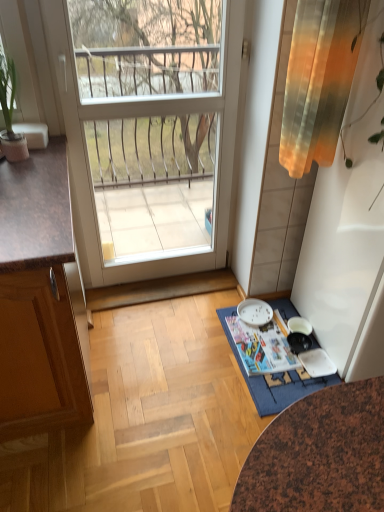
This screenshot has height=512, width=384. Describe the element at coordinates (88, 168) in the screenshot. I see `white glossy door at center` at that location.

Where is `white glossy door at center`? white glossy door at center is located at coordinates (88, 168).

Where is `blue fabric doormat at lower center`? The height and width of the screenshot is (512, 384). blue fabric doormat at lower center is located at coordinates (266, 384).

What do you see at coordinates (254, 312) in the screenshot? The height and width of the screenshot is (512, 384). I see `white glossy plate at lower center` at bounding box center [254, 312].

Find the location of `white glossy plate at lower center`. white glossy plate at lower center is located at coordinates (254, 312).

In order to click on gradient fabric curtain at upper right in this screenshot , I will do [319, 80].

Consider the image. Considering the sizes of gradient fabric curtain at upper right and white glossy plate at lower center in the image, is gradient fabric curtain at upper right bigger or smaller than white glossy plate at lower center?

Considering their sizes, gradient fabric curtain at upper right takes up more space than white glossy plate at lower center.

Are gradient fabric curtain at upper right and white glossy plate at lower center far apart?

Yes, gradient fabric curtain at upper right is far from white glossy plate at lower center.

Consider the image. From the image's perspective, which object appears higher, gradient fabric curtain at upper right or white glossy plate at lower center?

gradient fabric curtain at upper right is shown above in the image.

Which of these two, white glossy door at center or green leafy plant in pot at left, is wider?

Wider between the two is green leafy plant in pot at left.

Considering the sizes of objects white glossy door at center and green leafy plant in pot at left in the image provided, who is taller, white glossy door at center or green leafy plant in pot at left?

white glossy door at center.

Is point (65, 28) closer or farther from the camera than point (11, 94)?

Point (65, 28) is positioned closer to the camera compared to point (11, 94).

Is white glossy door at center inside the boundaries of green leafy plant in pot at left, or outside?

white glossy door at center is not inside green leafy plant in pot at left, it's outside.

Who is taller, white glossy plate at lower center or green leafy plant in pot at left?

Standing taller between the two is green leafy plant in pot at left.

Are white glossy plate at lower center and green leafy plant in pot at left making contact?

white glossy plate at lower center and green leafy plant in pot at left are clearly separated.

From a real-world perspective, is white glossy plate at lower center physically below green leafy plant in pot at left?

Yes, from a real-world perspective, white glossy plate at lower center is below green leafy plant in pot at left.

Which point is more distant from viewer, (312, 385) or (317, 114)?

Positioned behind is point (312, 385).

What's the angular difference between blue fabric doormat at lower center and gradient fabric curtain at upper right's facing directions?

The facing directions of blue fabric doormat at lower center and gradient fabric curtain at upper right are 0.434 degrees apart.

Based on the photo, considering the sizes of objects blue fabric doormat at lower center and gradient fabric curtain at upper right in the image provided, who is bigger, blue fabric doormat at lower center or gradient fabric curtain at upper right?

gradient fabric curtain at upper right.

Would you say blue fabric doormat at lower center is inside or outside gradient fabric curtain at upper right?

blue fabric doormat at lower center is located beyond the bounds of gradient fabric curtain at upper right.

Can you tell me how much white glossy plate at lower center and blue fabric doormat at lower center differ in facing direction?

There is a 0.434-degree angle between the facing directions of white glossy plate at lower center and blue fabric doormat at lower center.

Find the location of `doormat that is below the white glossy plate at lower center (from the image's perspective)`. doormat that is below the white glossy plate at lower center (from the image's perspective) is located at coordinates (266, 384).

Is white glossy plate at lower center outside of blue fabric doormat at lower center?

Indeed, white glossy plate at lower center is completely outside blue fabric doormat at lower center.

Considering the positions of objects white glossy plate at lower center and blue fabric doormat at lower center in the image provided, who is more to the left, white glossy plate at lower center or blue fabric doormat at lower center?

white glossy plate at lower center.

In terms of height, does blue fabric doormat at lower center look taller or shorter compared to white glossy plate at lower center?

In the image, blue fabric doormat at lower center appears to be shorter than white glossy plate at lower center.

Considering the positions of objects blue fabric doormat at lower center and white glossy plate at lower center in the image provided, who is more to the left, blue fabric doormat at lower center or white glossy plate at lower center?

white glossy plate at lower center.

Is blue fabric doormat at lower center closer to the viewer compared to white glossy plate at lower center?

Yes, the depth of blue fabric doormat at lower center is less than that of white glossy plate at lower center.

Is blue fabric doormat at lower center aimed at white glossy plate at lower center?

No, blue fabric doormat at lower center is not aimed at white glossy plate at lower center.

From the image's perspective, is white glossy door at center located above or below gradient fabric curtain at upper right?

From the image's perspective, white glossy door at center appears below gradient fabric curtain at upper right.

Measure the distance between white glossy door at center and gradient fabric curtain at upper right.

22.10 inches.

Does white glossy door at center lie behind gradient fabric curtain at upper right?

Yes, it is behind gradient fabric curtain at upper right.

Considering the points (69, 44) and (344, 5), which point is in front, point (69, 44) or point (344, 5)?

The point (344, 5) is closer to the camera.

The width and height of the screenshot is (384, 512). I want to click on curtain located in front of the white glossy plate at lower center, so click(319, 80).

What are the coordinates of `houseplant above the white glossy door at center (from the image's perspective)` in the screenshot? It's located at (10, 112).

From the image, which object appears to be nearer to gradient fabric curtain at upper right, blue fabric doormat at lower center or green leafy plant in pot at left?

green leafy plant in pot at left is positioned closer to the anchor gradient fabric curtain at upper right.

When comparing their distances from green leafy plant in pot at left, does gradient fabric curtain at upper right or white glossy plate at lower center seem closer?

Based on the image, gradient fabric curtain at upper right appears to be nearer to green leafy plant in pot at left.

Estimate the real-world distances between objects in this image. Which object is further from blue fabric doormat at lower center, gradient fabric curtain at upper right or white glossy door at center?

The object further to blue fabric doormat at lower center is gradient fabric curtain at upper right.

Considering their positions, is white glossy plate at lower center positioned further to blue fabric doormat at lower center than white glossy door at center?

white glossy door at center is further to blue fabric doormat at lower center.

Which object lies further to the anchor point green leafy plant in pot at left, white glossy door at center or white glossy plate at lower center?

The object further to green leafy plant in pot at left is white glossy plate at lower center.

From the image, which object appears to be nearer to gradient fabric curtain at upper right, white glossy door at center or white glossy plate at lower center?

Based on the image, white glossy door at center appears to be nearer to gradient fabric curtain at upper right.

Which object lies nearer to the anchor point blue fabric doormat at lower center, white glossy plate at lower center or green leafy plant in pot at left?

Among the two, white glossy plate at lower center is located nearer to blue fabric doormat at lower center.

Estimate the real-world distances between objects in this image. Which object is further from white glossy door at center, white glossy plate at lower center or gradient fabric curtain at upper right?

white glossy plate at lower center lies further to white glossy door at center than the other object.

You are a GUI agent. You are given a task and a screenshot of the screen. Output one action in this format:
    pyautogui.click(x=<x>, y=<y>)
    Task: Click on the door positioned between gradient fabric curtain at upper right and white glossy plate at lower center from near to far
    
    Given the screenshot: What is the action you would take?
    pyautogui.click(x=88, y=168)

Where is `plate between green leafy plant in pot at left and blue fabric doormat at lower center in the horizontal direction`? The image size is (384, 512). plate between green leafy plant in pot at left and blue fabric doormat at lower center in the horizontal direction is located at coordinates (254, 312).

You are a GUI agent. You are given a task and a screenshot of the screen. Output one action in this format:
    pyautogui.click(x=<x>, y=<y>)
    Task: Click on the door located between green leafy plant in pot at left and gradient fabric curtain at upper right in the left-right direction
    The height and width of the screenshot is (512, 384).
    Given the screenshot: What is the action you would take?
    pyautogui.click(x=88, y=168)

Image resolution: width=384 pixels, height=512 pixels. Find the location of `door between gradient fabric curtain at upper right and blue fabric doormat at lower center vertically`. door between gradient fabric curtain at upper right and blue fabric doormat at lower center vertically is located at coordinates (88, 168).